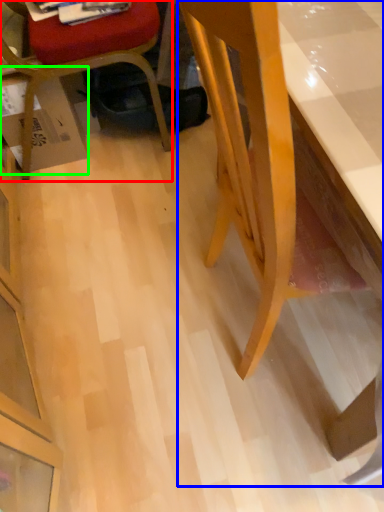
Question: Which object is positioned closest to chair (highlighted by a red box)? Select from desk (highlighted by a blue box) and cardboard box (highlighted by a green box).

Choices:
 (A) desk
 (B) cardboard box

Answer: (B)